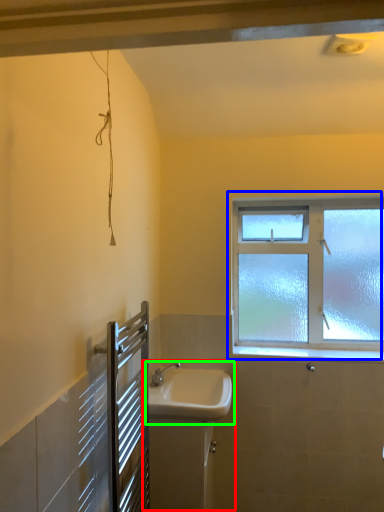
Question: Which object is positioned closest to sink (highlighted by a red box)? Select from window (highlighted by a blue box) and sink (highlighted by a green box).

Choices:
 (A) window
 (B) sink

Answer: (B)